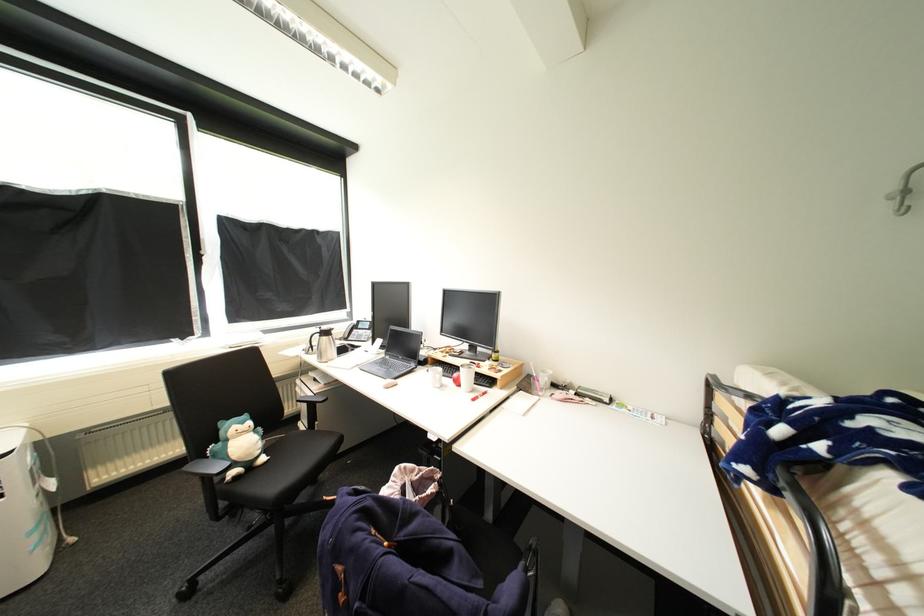
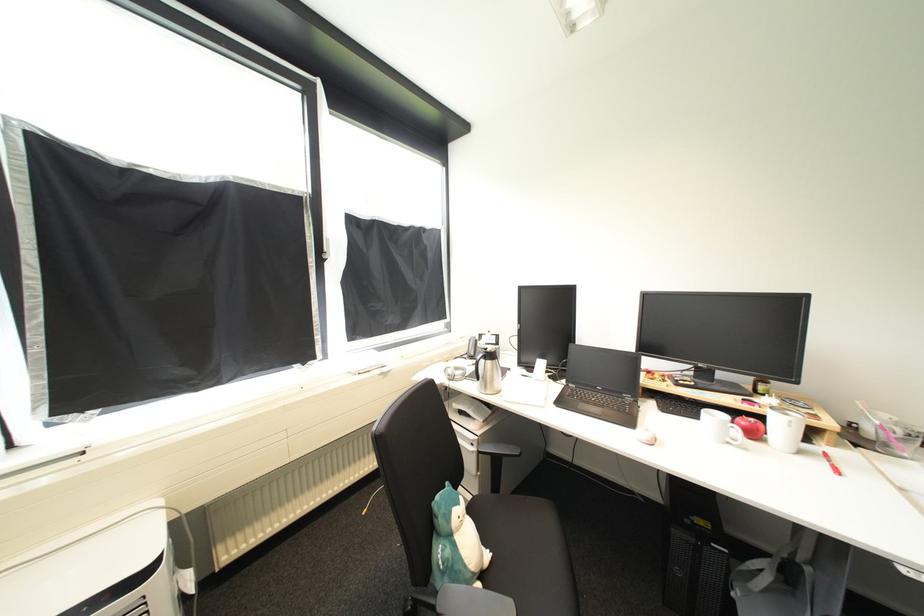
In the second image, find the point that corresponds to (x=445, y=389) in the first image.

(736, 445)